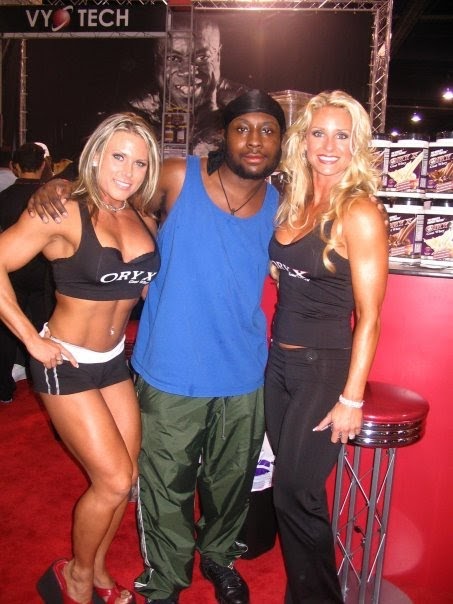
Image resolution: width=453 pixels, height=604 pixels. In order to click on side of stool in this screenshot , I will do `click(395, 432)`.